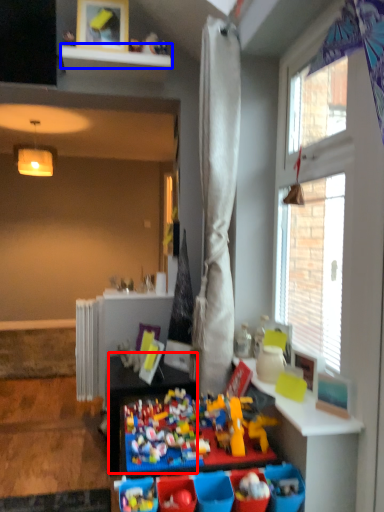
Question: Among these objects, which one is farthest to the camera, table (highlighted by a red box) or shelf (highlighted by a blue box)?

Choices:
 (A) table
 (B) shelf

Answer: (B)